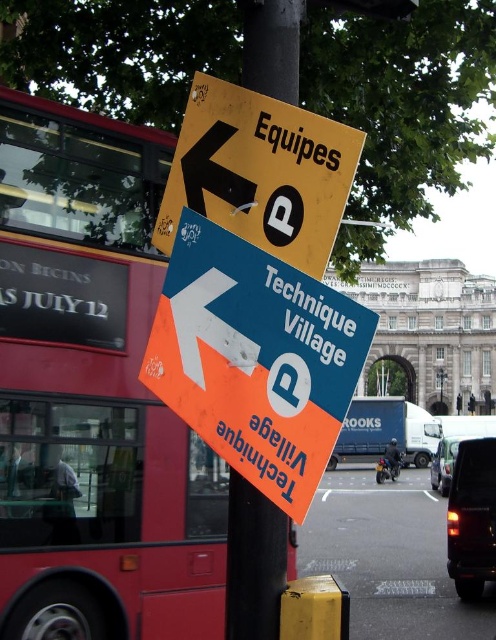
Question: Does red metallic bus at left lie behind blue metallic truck at center?

Choices:
 (A) yes
 (B) no

Answer: (A)

Question: Which point is farther to the camera?

Choices:
 (A) blue metallic truck at center
 (B) matte black car at lower right
 (C) yellow matte sign at upper left
 (D) red metallic bus at left

Answer: (B)

Question: Based on their relative distances, which object is nearer to the red metallic bus at left?

Choices:
 (A) matte black van at lower right
 (B) yellow matte sign at upper left

Answer: (B)

Question: Does matte black van at lower right come behind matte black car at lower right?

Choices:
 (A) no
 (B) yes

Answer: (A)

Question: Estimate the real-world distances between objects in this image. Which object is closer to the yellow matte sign at upper left?

Choices:
 (A) matte black car at lower right
 (B) black plastic pole at center
 (C) blue plastic sign at center
 (D) matte black van at lower right

Answer: (C)

Question: Can you confirm if yellow matte sign at upper left is positioned to the right of blue metallic truck at center?

Choices:
 (A) yes
 (B) no

Answer: (B)